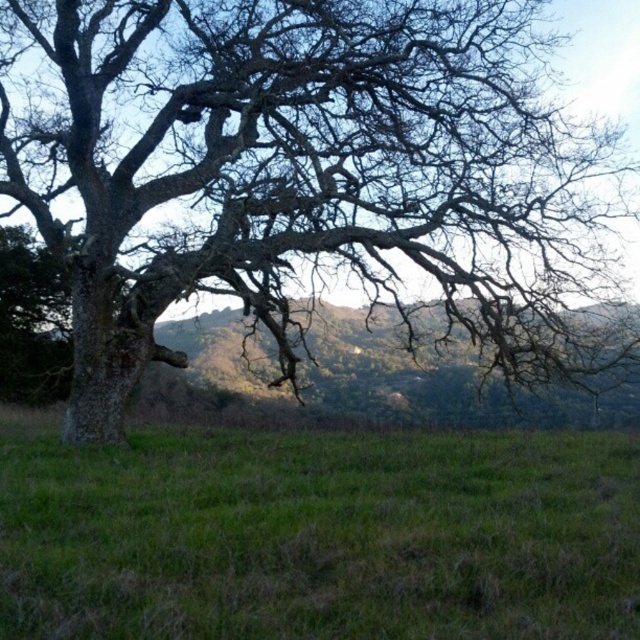
Is bare wood tree at left smaller than green grassy field at center?

No.

Does bare wood tree at left appear on the left side of green grassy field at center?

Yes, bare wood tree at left is to the left of green grassy field at center.

Where is `bare wood tree at left`? The height and width of the screenshot is (640, 640). bare wood tree at left is located at coordinates (300, 168).